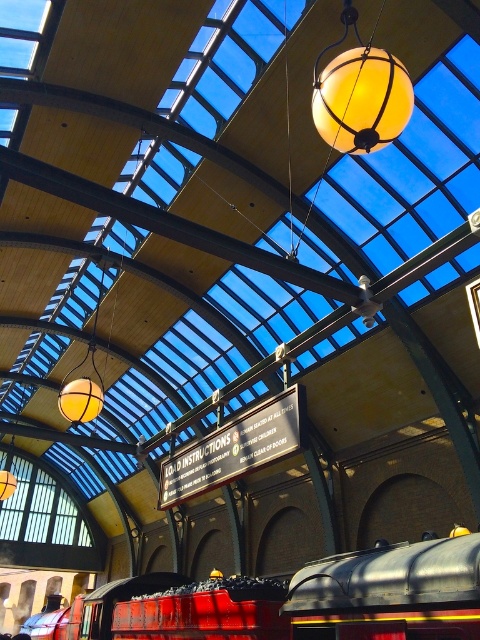
Is red glossy train at center positioned before translucent glass globe at center?

Yes, it is in front of translucent glass globe at center.

Which is behind, point (350, 627) or point (320, 112)?

Positioned behind is point (320, 112).

Where is `red glossy train at center`? The height and width of the screenshot is (640, 480). red glossy train at center is located at coordinates (388, 593).